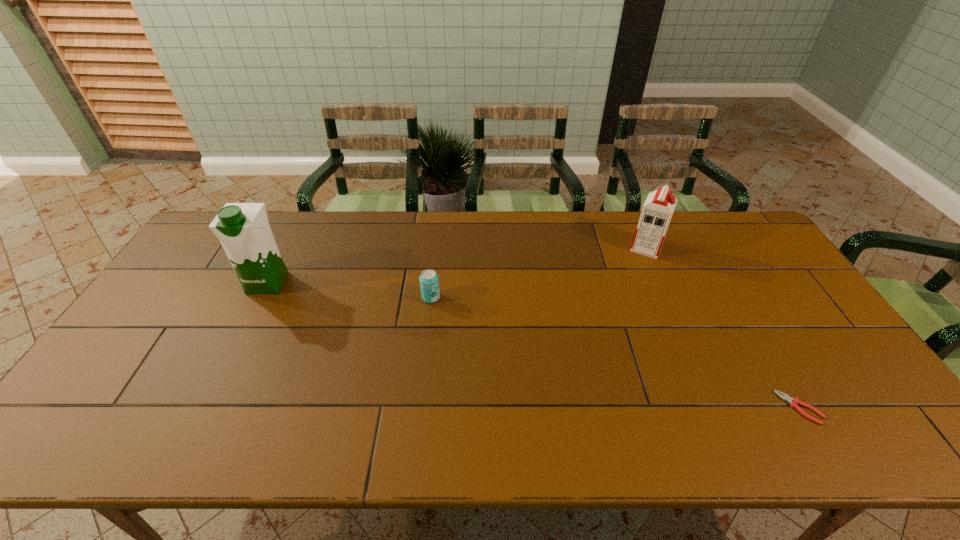
Where is `the taller soya milk`? the taller soya milk is located at coordinates (243, 229).

Find the location of `the left soya milk`. the left soya milk is located at coordinates (243, 229).

Where is `the shorter soya milk`? the shorter soya milk is located at coordinates (657, 211).

This screenshot has width=960, height=540. What are the coordinates of `the third shortest object` in the screenshot? It's located at (657, 211).

Locate an element on the screen. The width and height of the screenshot is (960, 540). the third object from right to left is located at coordinates (429, 283).

This screenshot has height=540, width=960. What are the coordinates of `the third tallest object` in the screenshot? It's located at pos(429,283).

This screenshot has height=540, width=960. I want to click on pliers, so click(x=784, y=396).

Image resolution: width=960 pixels, height=540 pixels. I want to click on the shortest object, so click(x=784, y=396).

Where is `vacant point located 0.360m on the front-facing side of the leftmost object`? vacant point located 0.360m on the front-facing side of the leftmost object is located at coordinates (205, 406).

This screenshot has height=540, width=960. I want to click on free space located on the right of the shorter soya milk, so click(x=738, y=247).